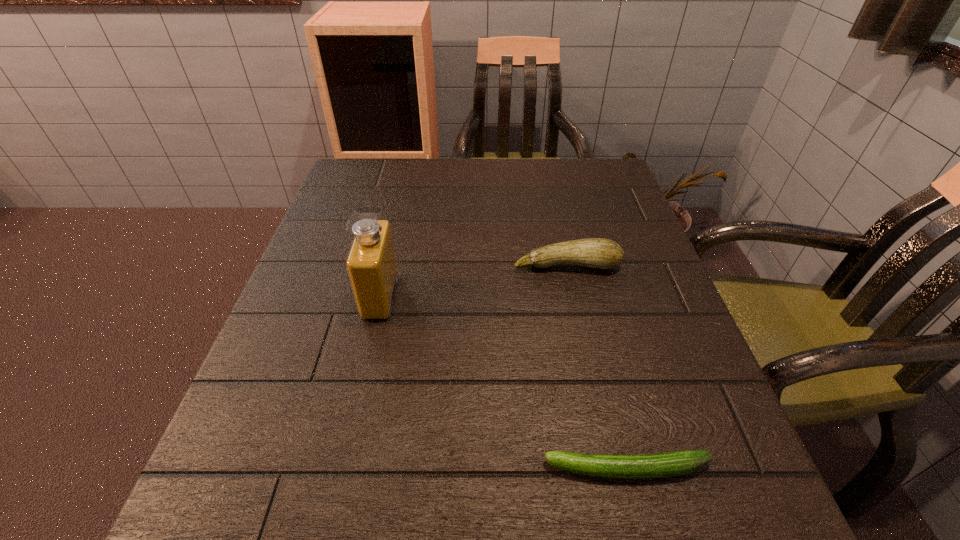
Where is `vacant space located on the front-facing side of the nearer zucchini`? vacant space located on the front-facing side of the nearer zucchini is located at coordinates (375, 469).

Locate an element on the screen. object located in the left edge section of the desktop is located at coordinates (371, 263).

Find the location of a particular element. Image resolution: width=960 pixels, height=540 pixels. free space at the far edge is located at coordinates (403, 182).

Where is `vacant region at the near edge of the desktop`? This screenshot has width=960, height=540. vacant region at the near edge of the desktop is located at coordinates (425, 517).

In the image, there is a desktop. At what (x,y) coordinates should I click in order to perform the action: click on free region at the left edge. Please return your answer as a coordinate pair (x, y). The width and height of the screenshot is (960, 540). Looking at the image, I should click on (393, 206).

Where is `vacant area at the right edge`? vacant area at the right edge is located at coordinates (577, 222).

Locate an element on the screen. vacant region at the far left corner of the desktop is located at coordinates (349, 198).

Where is `free space at the near left corner`? The width and height of the screenshot is (960, 540). free space at the near left corner is located at coordinates (209, 511).

Locate an element on the screen. free space at the far right corner is located at coordinates (612, 164).

This screenshot has height=540, width=960. I want to click on free spot between the taller zucchini and the shorter zucchini, so click(x=597, y=367).